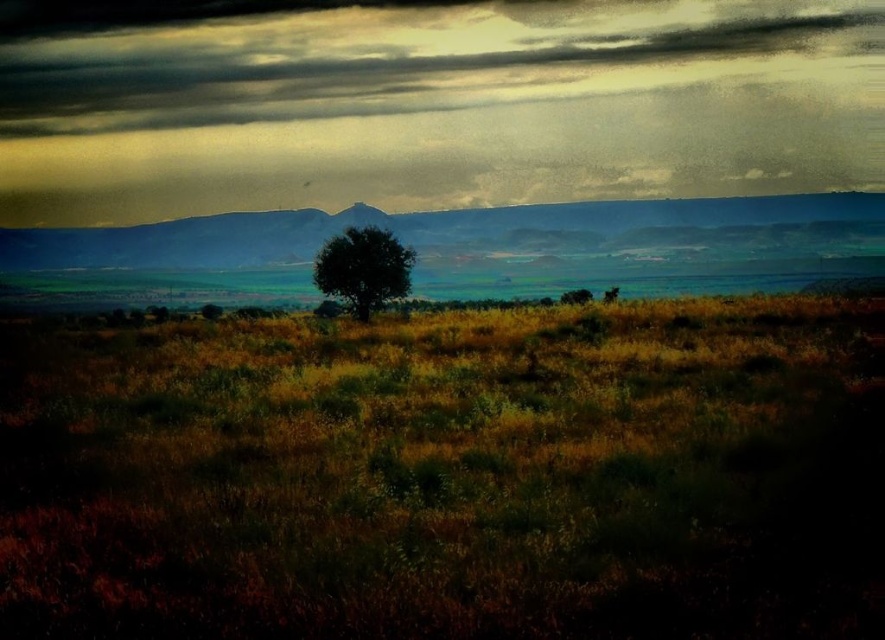
You are an artist sketching the landscape and want to draw the cloudy textured sky at upper center and the green matte tree at center. Which object should you sketch first if you follow the standard left to right drawing technique?

You should sketch the cloudy textured sky at upper center first because it is located to the left of the green matte tree at center, following the left to right drawing technique.

You are an environmental scientist assessing the health of a landscape. You observe two trees in the center of the image, a green leafy tree at center and a green matte tree at center. Which tree would you prioritize for further inspection based on their height differences?

The green leafy tree at center has a greater height compared to the green matte tree at center, so you should prioritize the green leafy tree at center for further inspection since it may indicate better health or growth potential.

You are an environmental scientist analyzing the landscape. You need to locate the green leafy tree at center for a study on biodiversity. Based on the coordinates provided, can you determine its exact position in the image?

The green leafy tree at center is located at coordinates point (363,268).